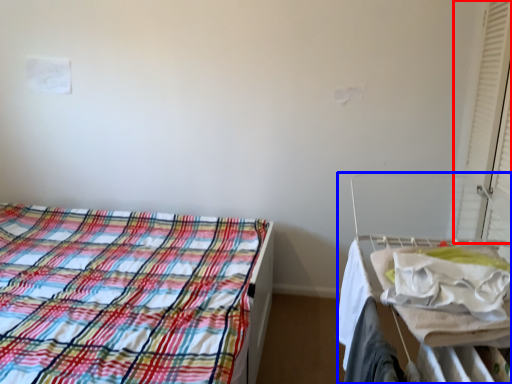
Question: Which point is further to the camera, curtain (highlighted by a red box) or hospital bed (highlighted by a blue box)?

Choices:
 (A) curtain
 (B) hospital bed

Answer: (A)